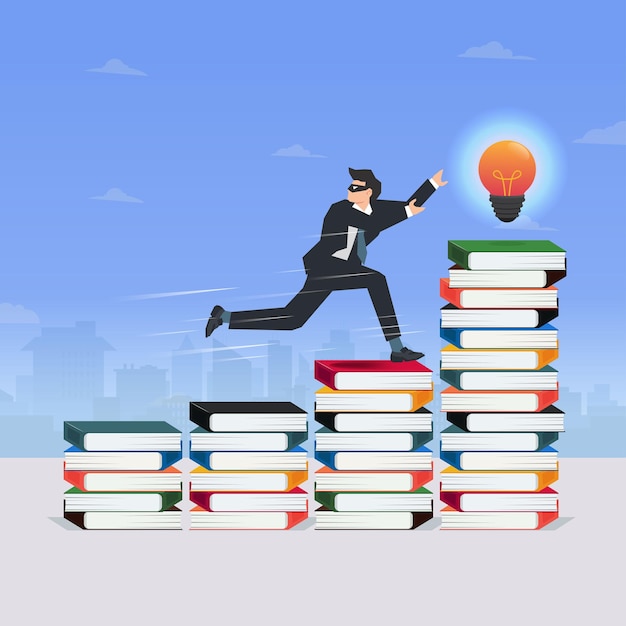
Identify the location of black books. (111, 521), (240, 418), (391, 518), (402, 424), (490, 426), (506, 320), (521, 280).